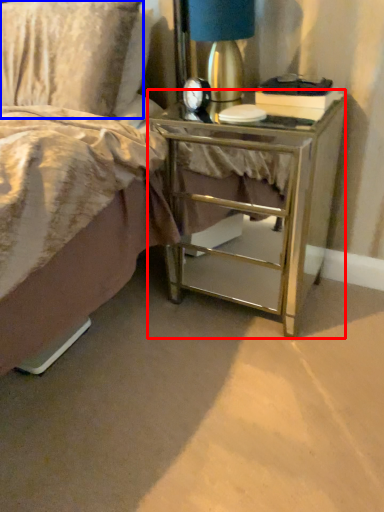
Question: Which point is closer to the camera, nightstand (highlighted by a red box) or pillow (highlighted by a blue box)?

Choices:
 (A) nightstand
 (B) pillow

Answer: (A)